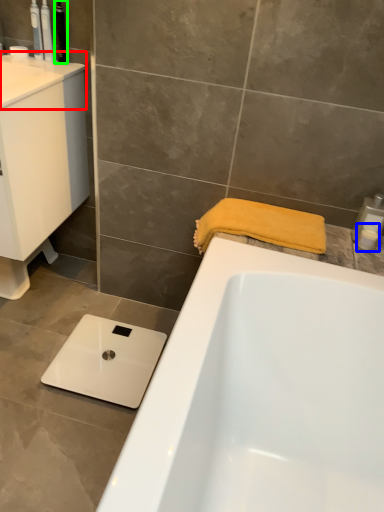
Question: Which object is positioned closest to counter top (highlighted by a red box)? Select from toiletry (highlighted by a blue box) and toiletry (highlighted by a green box).

Choices:
 (A) toiletry
 (B) toiletry

Answer: (B)